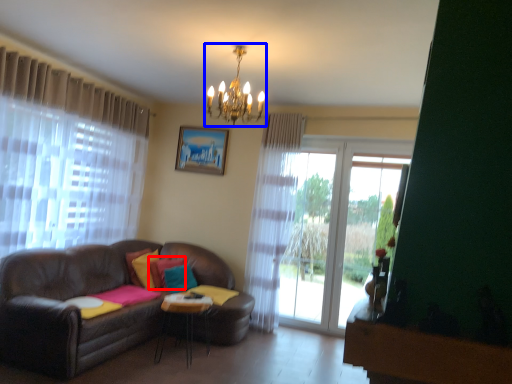
Question: Among these objects, which one is farthest to the camera, pillow (highlighted by a red box) or light fixture (highlighted by a blue box)?

Choices:
 (A) pillow
 (B) light fixture

Answer: (A)